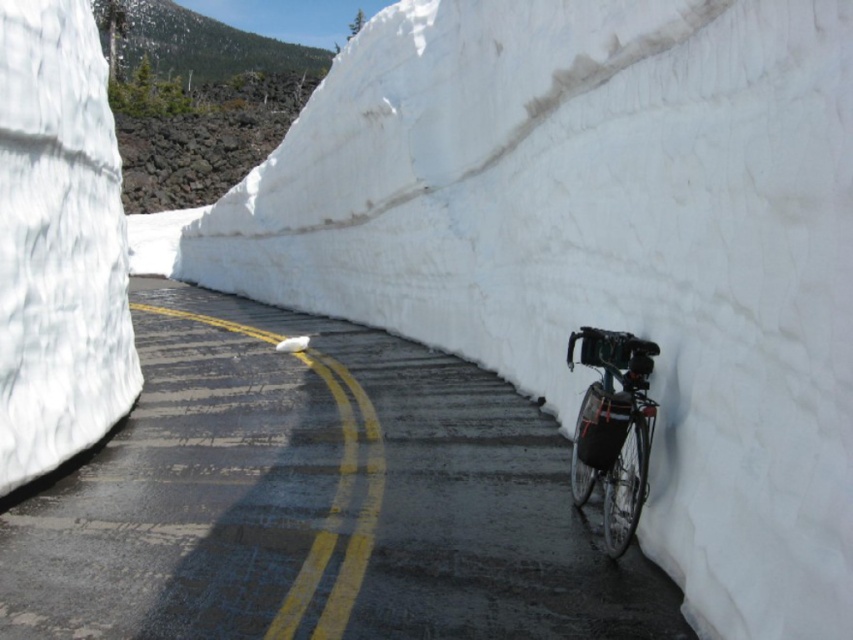
You are a delivery driver who needs to drive a truck that is 12 feet tall through the road. The road is flanked by snowbanks. Given the information about the black asphalt road at center and the shiny metallic bicycle at right, can you determine if your truck will clear the height of the snowbanks on either side?

The black asphalt road at center is not as tall as shiny metallic bicycle at right, which means the road itself is lower than the bicycle. Since the snowbanks flank the road, their height would likely exceed the road level. However, the description does not provide specific measurements for the snowbanks. Without knowing the exact height of the snowbanks, it is impossible to determine if the 12 feet tall truck will clear them.

You are standing at the center of the road surrounded by snowbanks. You notice two points marked on the road. Which point is closer to you, point (88, 616) or point (636, 429)?

Point (88, 616) is closer to the viewer than point (636, 429).

You are a delivery driver who needs to navigate through the road. The black asphalt road at center is the path you must follow. However, you notice the shiny metallic bicycle at right parked on the side. Given the road is narrow due to the snowbanks, can you safely pass the bicycle without crossing into the opposite lane?

The black asphalt road at center is positioned on the left side of shiny metallic bicycle at right. Since the road is narrow with snowbanks on both sides, you must stay within your lane. To safely pass the bicycle, you can slow down and carefully maneuver around it while staying on the black asphalt road at center, ensuring not to cross the double yellow lines into the opposite lane.